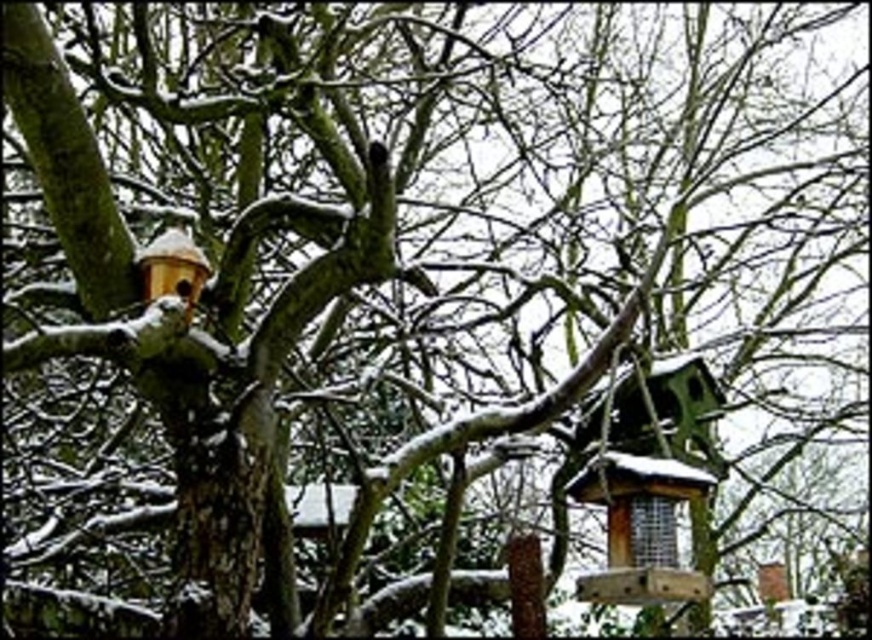
Question: Which of the following is the closest to the observer?

Choices:
 (A) green wooden bird feeder at center
 (B) wooden bird feeder at upper left

Answer: (B)

Question: Is green wooden bird feeder at center thinner than wooden bird feeder at upper left?

Choices:
 (A) yes
 (B) no

Answer: (B)

Question: Does green wooden bird feeder at center appear over wooden bird feeder at upper left?

Choices:
 (A) yes
 (B) no

Answer: (B)

Question: Does green wooden bird feeder at center have a lesser width compared to wooden bird feeder at upper left?

Choices:
 (A) yes
 (B) no

Answer: (B)

Question: Which object is farther from the camera taking this photo?

Choices:
 (A) wooden bird feeder at upper left
 (B) green wooden bird feeder at center

Answer: (B)

Question: Which point is closer to the camera?

Choices:
 (A) green wooden bird feeder at center
 (B) wooden bird feeder at upper left

Answer: (B)